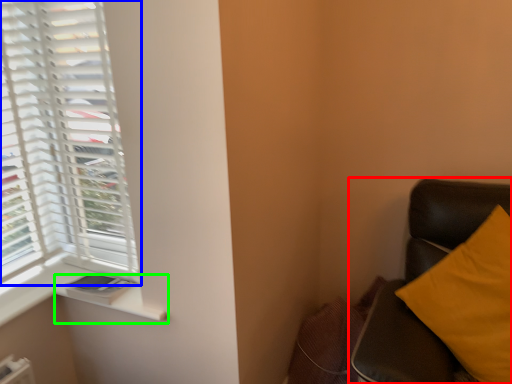
Question: Based on their relative distances, which object is nearer to furniture (highlighted by a red box)? Choose from window (highlighted by a blue box) and window sill (highlighted by a green box).

Choices:
 (A) window
 (B) window sill

Answer: (B)